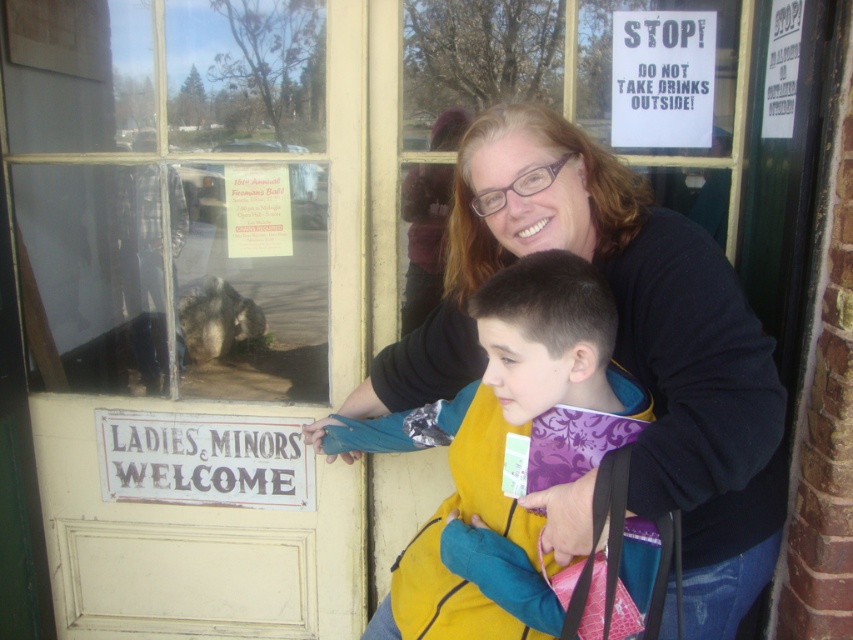
You are a delivery person with a package that requires a 36 inch clearance to maneuver safely. You are standing in front of the white painted wood door at center and need to pass by the yellow fleece vest at center to reach the drop off point. Can you safely navigate the space between them?

The distance between the white painted wood door at center and the yellow fleece vest at center is 32.91 inches, which is less than the required 36 inch clearance. Therefore, you cannot safely navigate the space between them.

You are a delivery person trying to hand over a package to the recipient. You see the white painted wood door at center and the yellow fleece vest at center. Which object is wider so you can decide where to place the package?

The white painted wood door at center is wider than the yellow fleece vest at center, so you should place the package on the white painted wood door at center.